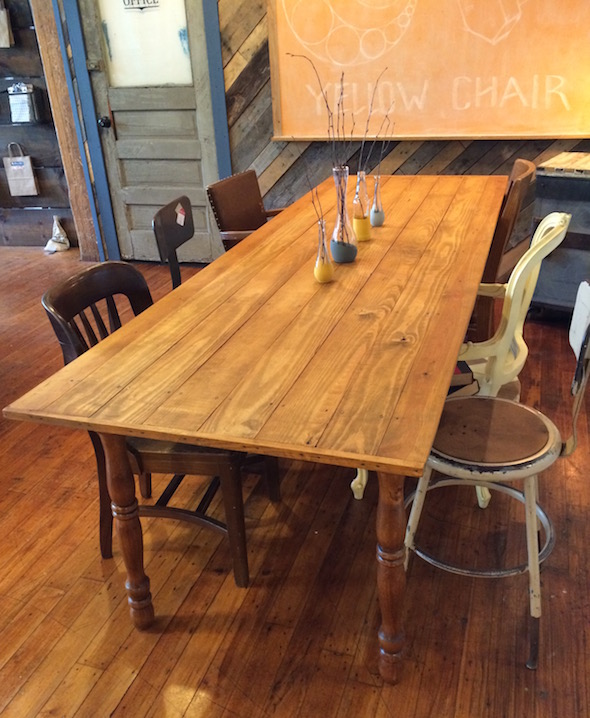
Find the location of a particular element. This screenshot has height=718, width=590. 4 table center pieces is located at coordinates (324, 270), (345, 255), (362, 220), (372, 210).